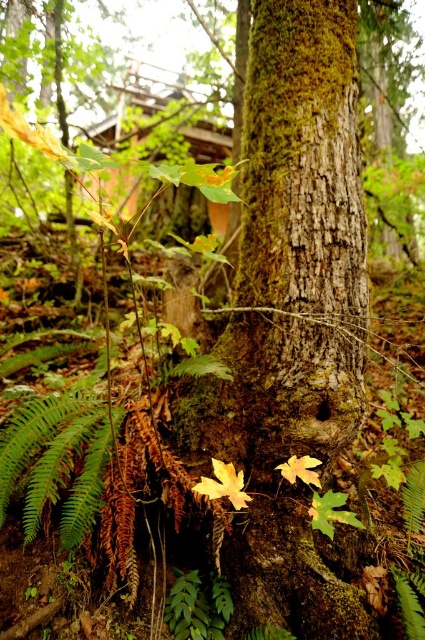
You are standing at the center of the forest scene. There is a green glossy fern at lower left. Can you see the wooden structure in the midground from your current position?

The green glossy fern at lower left is at point (56,460), so yes, you can see the wooden structure in the midground from your current position because the fern is located at the lower left and the wooden structure is in the midground, which is further back and not obstructed by the fern.

You are standing in the forest scene and want to reach both points marked in the image. Which point, point [221,472] or point [300,461], will you encounter first as you move forward?

Point [221,472] is closer to the camera than point [300,461], so you will encounter point [221,472] first as you move forward.

You are a hiker who wants to place a small marker between the green glossy fern at lower left and the yellow matte maple leaf at center. Which direction should you walk from the fern to reach the spot where you can place the marker between them?

To place the marker between the green glossy fern at lower left and the yellow matte maple leaf at center, you should walk to the right from the fern since the fern is positioned to the left of the maple leaf.